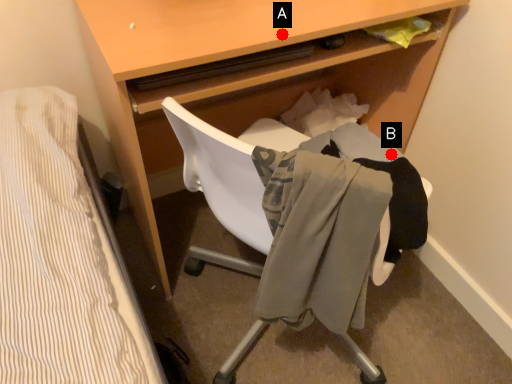
Question: Two points are circled on the image, labeled by A and B beside each circle. Which of the following is the farthest from the observer?

Choices:
 (A) A is further
 (B) B is further

Answer: (B)